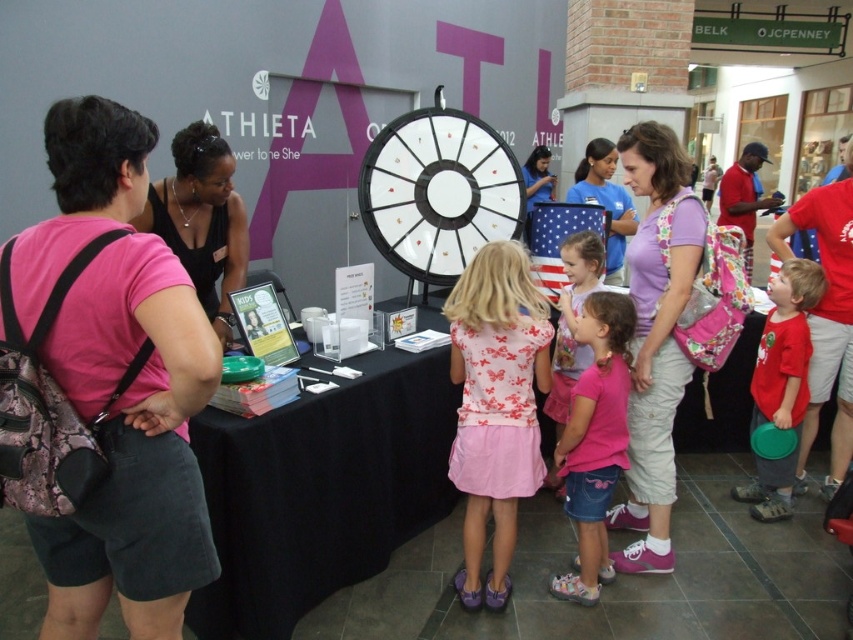
Is pink cotton shirt at center taller than black matte tank top at upper left?

Yes, pink cotton shirt at center is taller than black matte tank top at upper left.

Locate an element on the screen. The width and height of the screenshot is (853, 640). pink cotton shirt at center is located at coordinates (595, 440).

Is purple floral backpack at center behind pink cotton dress at center?

No, it is in front of pink cotton dress at center.

Who is taller, purple floral backpack at center or pink cotton dress at center?

With more height is purple floral backpack at center.

What do you see at coordinates (654, 339) in the screenshot? The width and height of the screenshot is (853, 640). I see `purple floral backpack at center` at bounding box center [654, 339].

Where is `purple floral backpack at center`? This screenshot has width=853, height=640. purple floral backpack at center is located at coordinates (654, 339).

Who is positioned more to the left, black matte tank top at upper left or green plastic frisbee at right?

Positioned to the left is black matte tank top at upper left.

Is point (202, 195) less distant than point (776, 312)?

Yes.

Describe the element at coordinates (202, 218) in the screenshot. The height and width of the screenshot is (640, 853). I see `black matte tank top at upper left` at that location.

The width and height of the screenshot is (853, 640). Find the location of `black matte tank top at upper left`. black matte tank top at upper left is located at coordinates (202, 218).